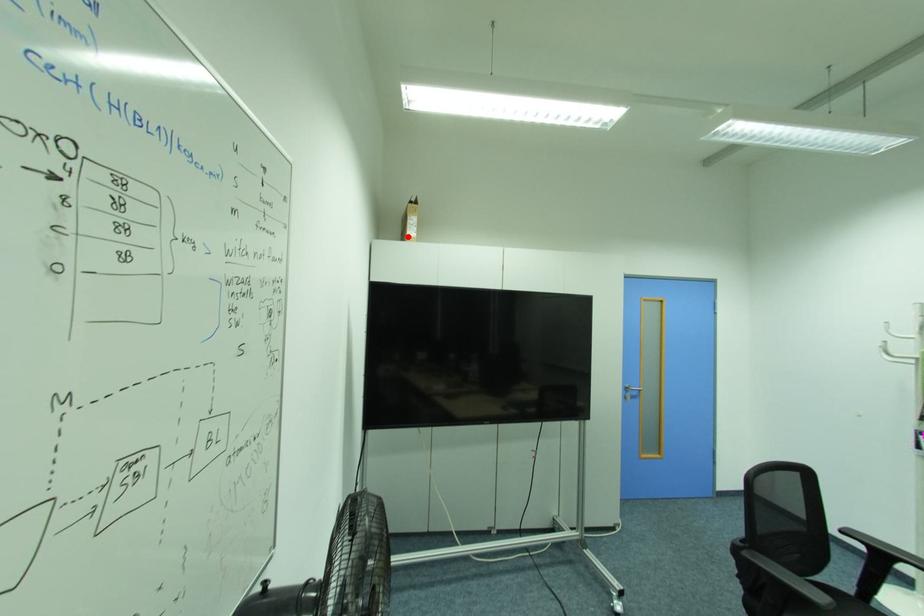
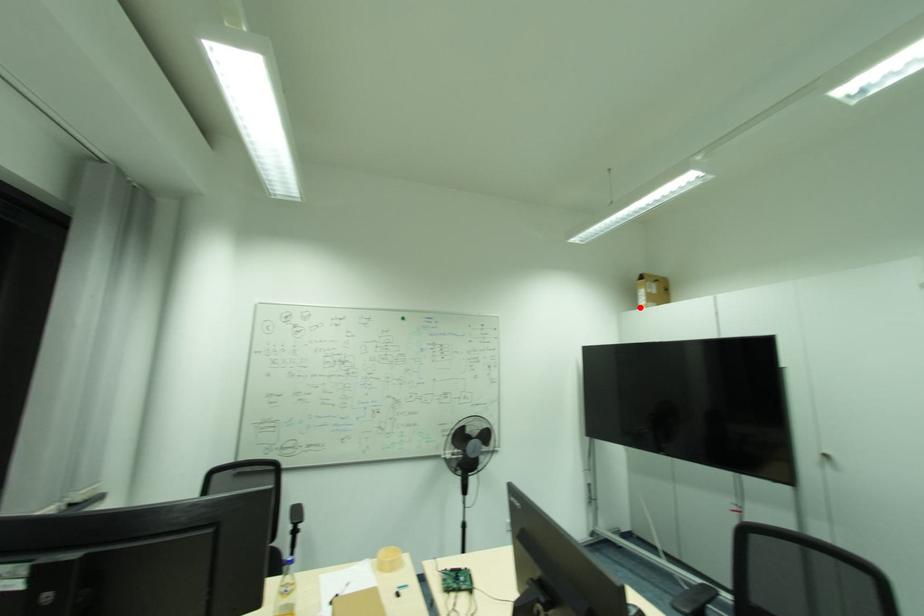
I am providing you with two images of the same scene from different viewpoints. A red point is marked on the first image and another point is marked on the second image. Is the red point in image1 aligned with the point shown in image2?

Yes